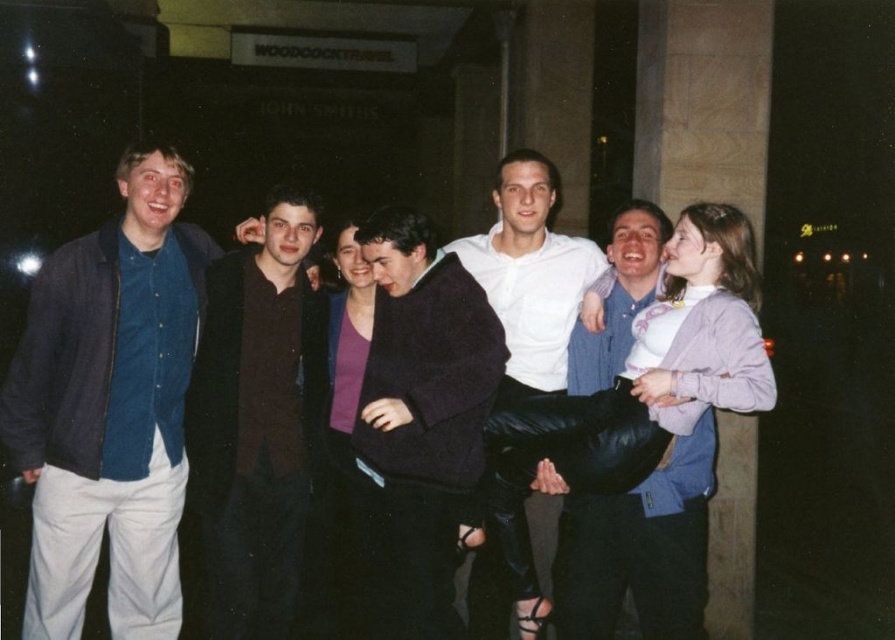
Question: Can you confirm if light purple sweater at center is positioned below purple matte sweater at center?

Choices:
 (A) no
 (B) yes

Answer: (A)

Question: Based on their relative distances, which object is nearer to the matte blue shirt at left?

Choices:
 (A) light purple sweater at center
 (B) dark brown leather jacket at center

Answer: (B)

Question: Which of the following is the farthest from the observer?

Choices:
 (A) (667, 544)
 (B) (15, 372)
 (C) (261, 477)
 (D) (401, 224)

Answer: (C)

Question: Is dark brown leather jacket at center behind light purple sweater at center?

Choices:
 (A) no
 (B) yes

Answer: (B)

Question: Among these objects, which one is nearest to the camera?

Choices:
 (A) purple matte sweater at center
 (B) dark brown leather jacket at center

Answer: (B)

Question: Does matte blue shirt at left appear under light purple sweater at center?

Choices:
 (A) no
 (B) yes

Answer: (A)